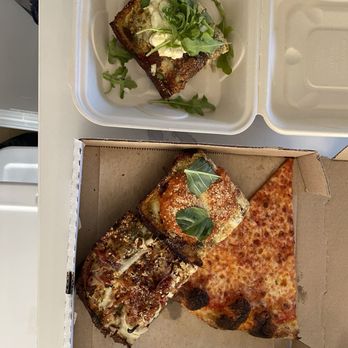
Where is `foam`? The image size is (348, 348). foam is located at coordinates (308, 74).